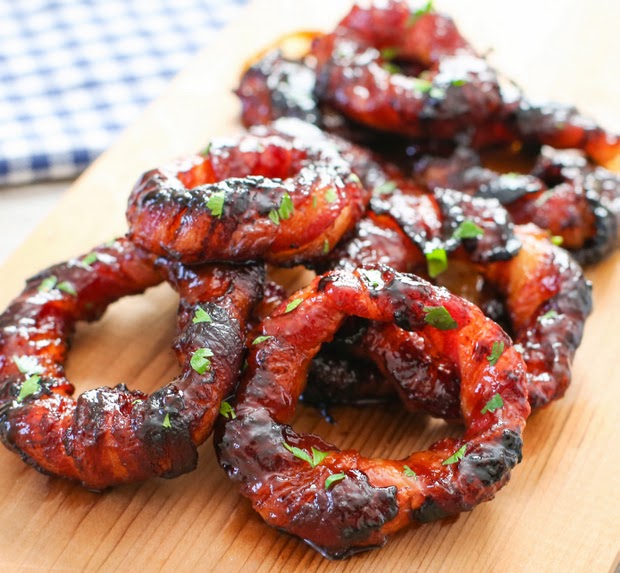
Where is `white table top surface`? white table top surface is located at coordinates (20, 204).